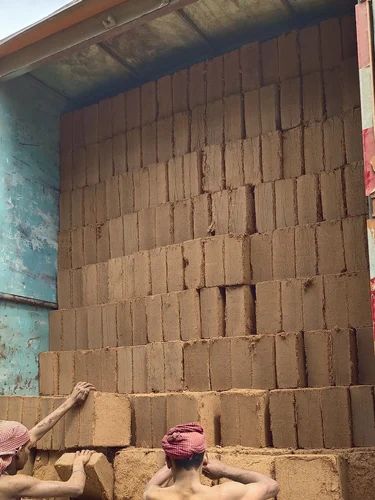
Locate an element on the screen. This screenshot has width=375, height=500. ceiling is located at coordinates (155, 46).